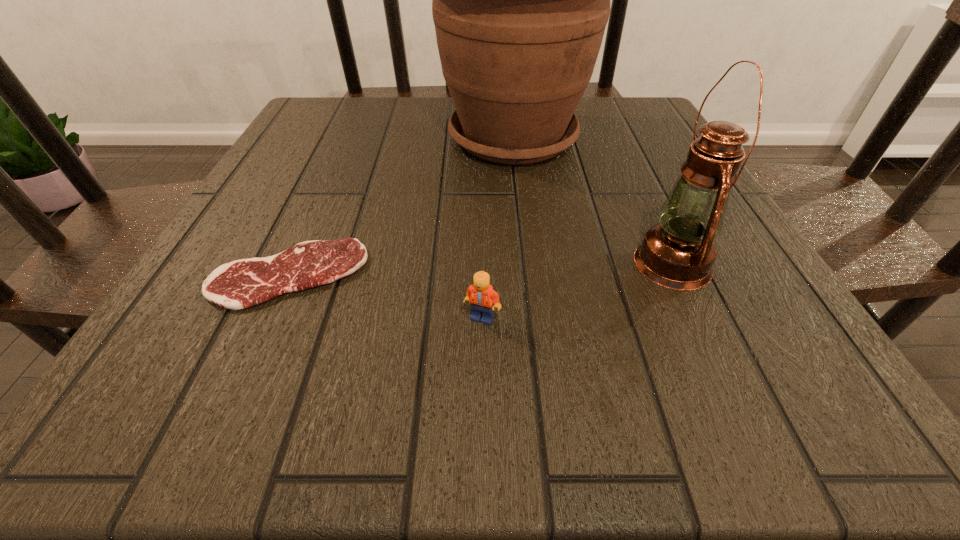
This screenshot has height=540, width=960. Identify the location of object that stands as the second closest to the flowerpot. (243, 283).

I want to click on vacant region that satisfies the following two spatial constraints: 1. on the front side of the farthest object; 2. on the left side of the oil lamp, so click(527, 264).

The image size is (960, 540). I want to click on vacant space that satisfies the following two spatial constraints: 1. on the back side of the farthest object; 2. on the right side of the steak, so click(350, 138).

Locate an element on the screen. The image size is (960, 540). vacant space that satisfies the following two spatial constraints: 1. on the back side of the steak; 2. on the right side of the oil lamp is located at coordinates (294, 264).

Where is `vacant region that satisfies the following two spatial constraints: 1. on the back side of the steak; 2. on the right side of the oil lamp`? This screenshot has height=540, width=960. vacant region that satisfies the following two spatial constraints: 1. on the back side of the steak; 2. on the right side of the oil lamp is located at coordinates (294, 264).